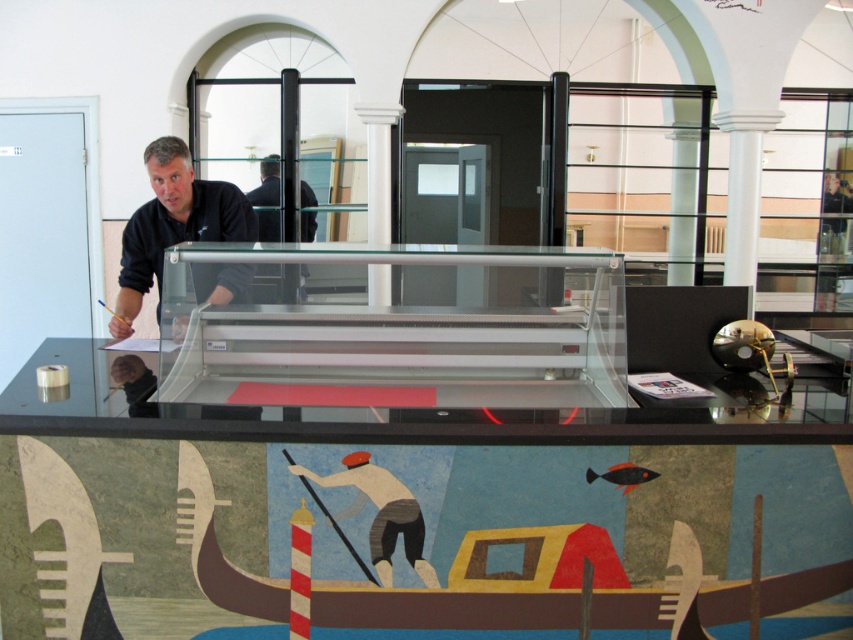
Question: Can you confirm if black matte shirt at upper left is positioned below dark blue shirt at center?

Choices:
 (A) no
 (B) yes

Answer: (B)

Question: Among these objects, which one is nearest to the camera?

Choices:
 (A) black matte shirt at upper left
 (B) dark blue shirt at center

Answer: (A)

Question: Is black matte shirt at upper left smaller than dark blue shirt at center?

Choices:
 (A) yes
 (B) no

Answer: (A)

Question: Does black matte shirt at upper left appear under dark blue shirt at center?

Choices:
 (A) no
 (B) yes

Answer: (B)